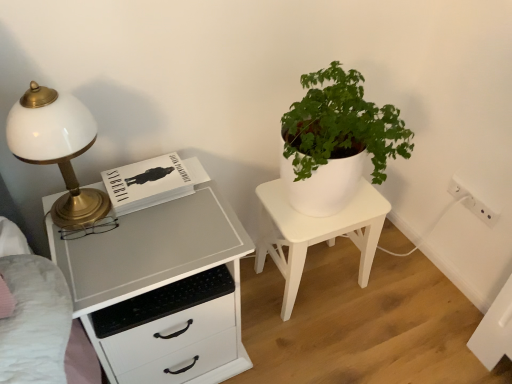
Question: Based on their sizes in the image, would you say white glossy chest of drawers at left is bigger or smaller than white matte/porcelain nightstand at center?

Choices:
 (A) big
 (B) small

Answer: (A)

Question: Is white glossy chest of drawers at left in front of or behind white matte/porcelain nightstand at center in the image?

Choices:
 (A) behind
 (B) front

Answer: (B)

Question: Which object is the closest to the white glossy lamp at left?

Choices:
 (A) white glossy chest of drawers at left
 (B) white plastic electric outlet at lower right
 (C) white matte/porcelain nightstand at center

Answer: (A)

Question: Which object is positioned closest to the white plastic electric outlet at lower right?

Choices:
 (A) white glossy lamp at left
 (B) white matte/porcelain nightstand at center
 (C) white glossy chest of drawers at left

Answer: (B)